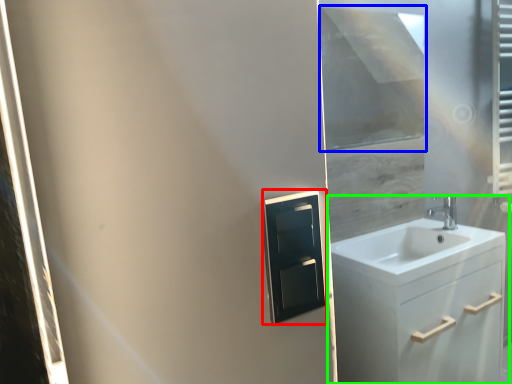
Question: Based on their relative distances, which object is farther from medicine cabinet (highlighted by a red box)? Choose from window screen (highlighted by a blue box) and bathroom cabinet (highlighted by a green box).

Choices:
 (A) window screen
 (B) bathroom cabinet

Answer: (A)